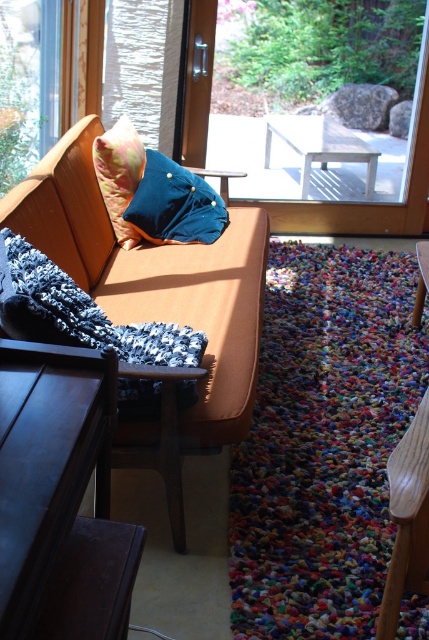
Question: Can you confirm if matte blue cushion at center is positioned to the right of wooden table at center?

Choices:
 (A) yes
 (B) no

Answer: (B)

Question: Which object is the farthest from the matte yellow-green pillow at upper center?

Choices:
 (A) matte glass screen door at upper center
 (B) dark wood table at lower left
 (C) black fuzzy pillow at lower left
 (D) wooden couch at center

Answer: (B)

Question: Which point is closer to the camera?

Choices:
 (A) transparent glass door at upper center
 (B) wooden table at center
 (C) wooden couch at center
 (D) matte blue cushion at center

Answer: (C)

Question: Is matte blue cushion at center above white plastic table at center?

Choices:
 (A) no
 (B) yes

Answer: (A)

Question: Which of these objects is positioned farthest from the wooden couch at center?

Choices:
 (A) matte yellow-green pillow at upper center
 (B) matte glass screen door at upper center
 (C) transparent glass window at upper left
 (D) dark wood table at lower left

Answer: (B)

Question: Is transparent glass window at upper left to the left of wooden table at center from the viewer's perspective?

Choices:
 (A) yes
 (B) no

Answer: (A)